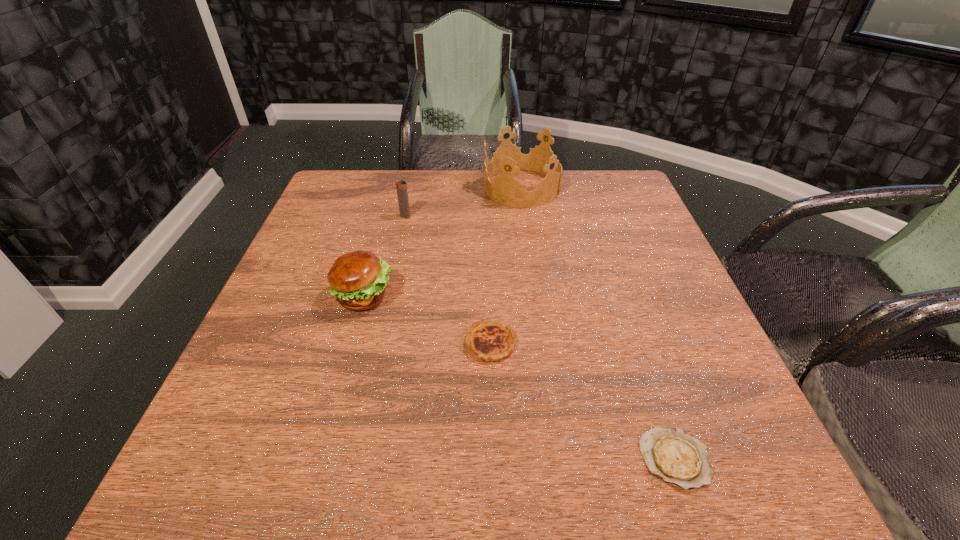
This screenshot has height=540, width=960. I want to click on object positioned at the near right corner, so click(673, 455).

In the image, there is a desktop. Where is `vacant area at the far edge`? This screenshot has width=960, height=540. vacant area at the far edge is located at coordinates (475, 206).

This screenshot has height=540, width=960. Identify the location of free space at the near edge of the desktop. (300, 458).

The height and width of the screenshot is (540, 960). Identify the location of vacant space at the left edge of the desktop. (360, 217).

Where is `free space at the right edge`? free space at the right edge is located at coordinates (648, 400).

Where is `free space at the far left corner of the desktop`? This screenshot has height=540, width=960. free space at the far left corner of the desktop is located at coordinates (351, 211).

At what (x,y) coordinates should I click in order to perform the action: click on blank space at the far right corner of the desktop. Please return your answer as a coordinate pair (x, y). The width and height of the screenshot is (960, 540). Looking at the image, I should click on (635, 208).

You are a GUI agent. You are given a task and a screenshot of the screen. Output one action in this format:
    pyautogui.click(x=<x>, y=<y>)
    Task: Click on the free space at the near right corner of the desktop
    Image resolution: width=960 pixels, height=540 pixels.
    Given the screenshot: What is the action you would take?
    pyautogui.click(x=737, y=459)

At what (x,y) coordinates should I click in order to perform the action: click on free space between the tallest object and the second farthest object. Please return your answer as a coordinate pair (x, y). The image size is (960, 540). Looking at the image, I should click on (464, 202).

In order to click on unoccupied area between the nearest object and the fourth farthest object in this screenshot , I will do `click(583, 401)`.